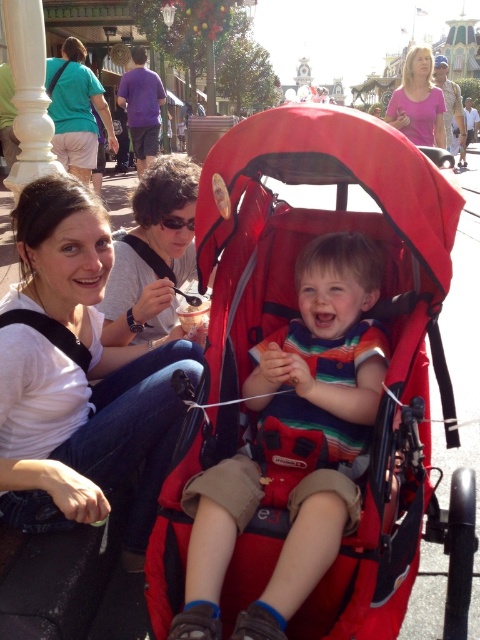
Question: Is striped cotton shirt at center bigger than teal cotton shirt at upper left?

Choices:
 (A) yes
 (B) no

Answer: (B)

Question: Which of the following is the farthest from the observer?

Choices:
 (A) (395, 90)
 (B) (142, 228)
 (C) (93, 305)
 (D) (224, 460)

Answer: (A)

Question: Is striped cotton shirt at center in front of matte white shirt at upper left?

Choices:
 (A) no
 (B) yes

Answer: (B)

Question: Which of the following is the closest to the observer?

Choices:
 (A) (148, 198)
 (B) (311, 408)
 (C) (72, 268)

Answer: (B)

Question: Which point appears closest to the camera in this image?

Choices:
 (A) (86, 172)
 (B) (421, 99)
 (C) (154, 513)

Answer: (C)

Question: Is teal cotton shirt at upper left smaller than pink fabric shirt at upper center?

Choices:
 (A) no
 (B) yes

Answer: (B)